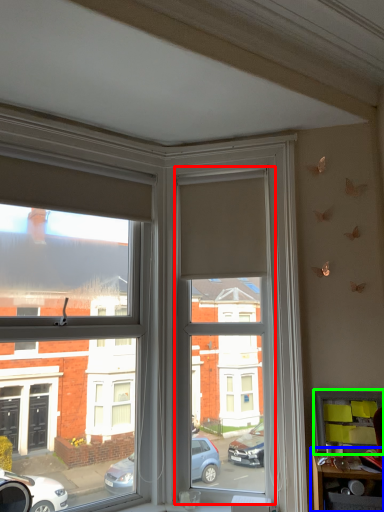
Question: Estimate the real-world distances between objects in this image. Which object is closer to window screen (highlighted by a red box), table (highlighted by a blue box) or shelf (highlighted by a green box)?

Choices:
 (A) table
 (B) shelf

Answer: (B)